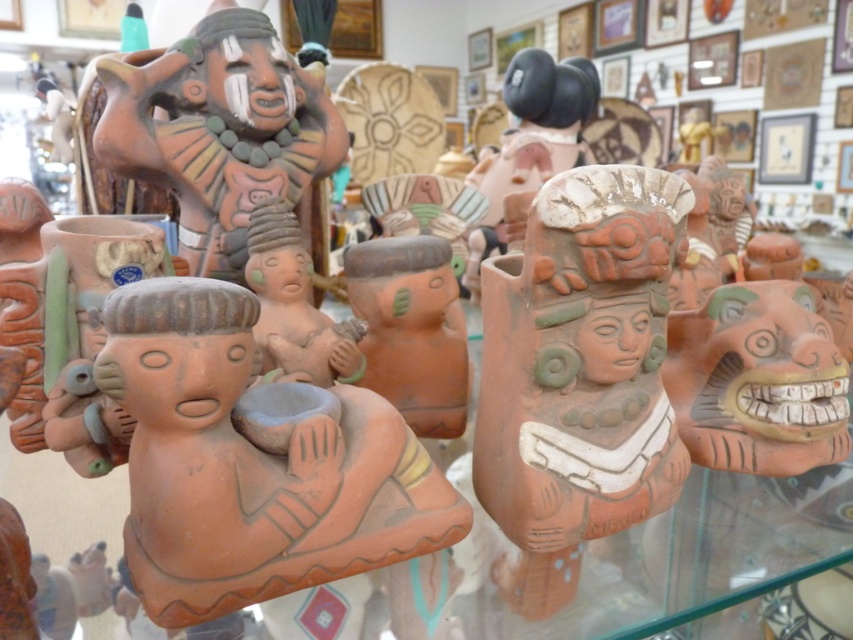
Question: Estimate the real-world distances between objects in this image. Which object is closer to the matte clay figurine at center?

Choices:
 (A) terracotta clay figure at center
 (B) terracotta clay mask at center-right

Answer: (B)

Question: Which point appears farthest from the camera in this image?

Choices:
 (A) (796, 385)
 (B) (635, 308)

Answer: (A)

Question: Does terracotta clay figure at center appear on the right side of terracotta clay mask at center-right?

Choices:
 (A) no
 (B) yes

Answer: (A)

Question: Is matte clay figurine at center to the left of terracotta clay mask at center-right from the viewer's perspective?

Choices:
 (A) no
 (B) yes

Answer: (B)

Question: Does terracotta clay figure at center appear on the left side of terracotta clay mask at center-right?

Choices:
 (A) yes
 (B) no

Answer: (A)

Question: Which point appears farthest from the camera in this image?

Choices:
 (A) (157, 532)
 (B) (517, 381)

Answer: (B)